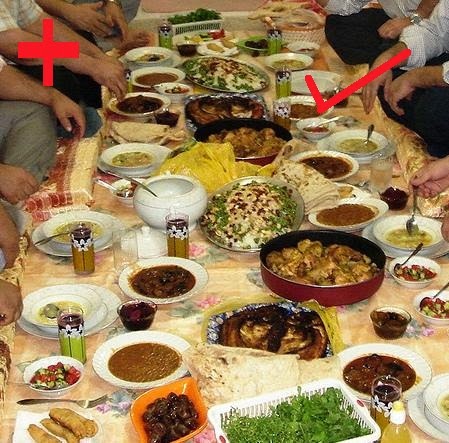
I want to click on tureen lid, so click(145, 244).